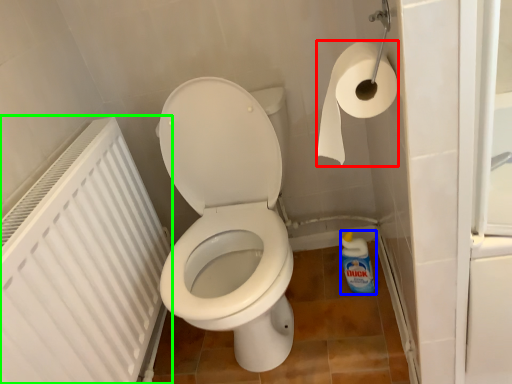
Question: Estimate the real-world distances between objects in this image. Which object is closer to toilet paper (highlighted by a red box), cleaning product (highlighted by a blue box) or radiator (highlighted by a green box)?

Choices:
 (A) cleaning product
 (B) radiator

Answer: (B)